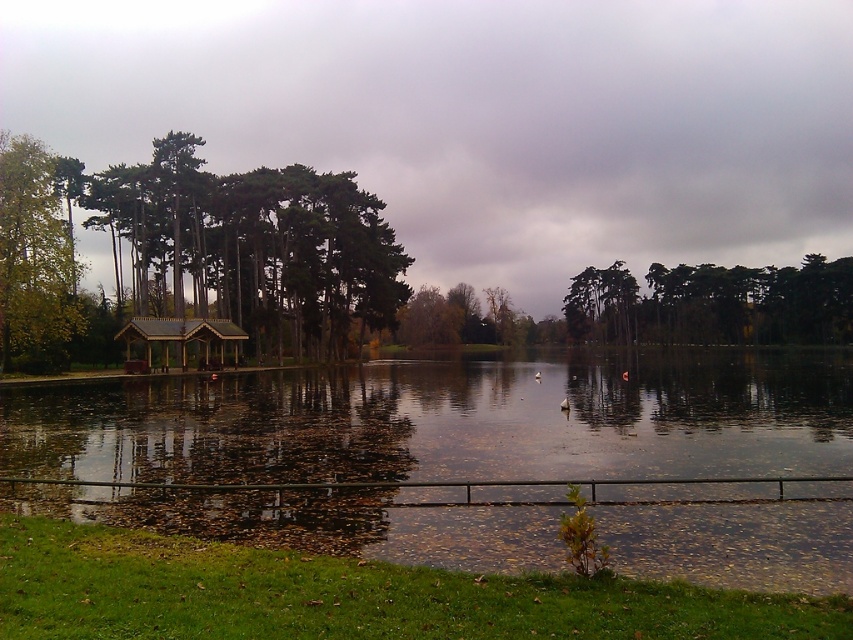
You are planning to take a photo of the reflective water at center and the green leafy tree at left. Which object would you need to frame more tightly in your camera viewfinder to capture its full detail, and why?

You should frame the reflective water at center more tightly because it has a smaller size compared to the green leafy tree at left, so it requires closer focus to capture its details fully.

You are standing at the lakeside and want to take a photo of both the green textured tree at center and the wooden gazebo at center. Which object should you position closer to the camera to ensure both are fully visible in the frame?

The green textured tree at center might be wider than the wooden gazebo at center, so you should position the wider object closer to the camera to ensure both fit in the frame.